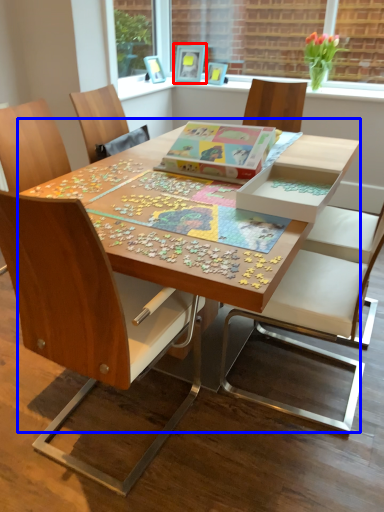
Question: Which point is closer to the camera, picture frame (highlighted by a red box) or table (highlighted by a blue box)?

Choices:
 (A) picture frame
 (B) table

Answer: (B)